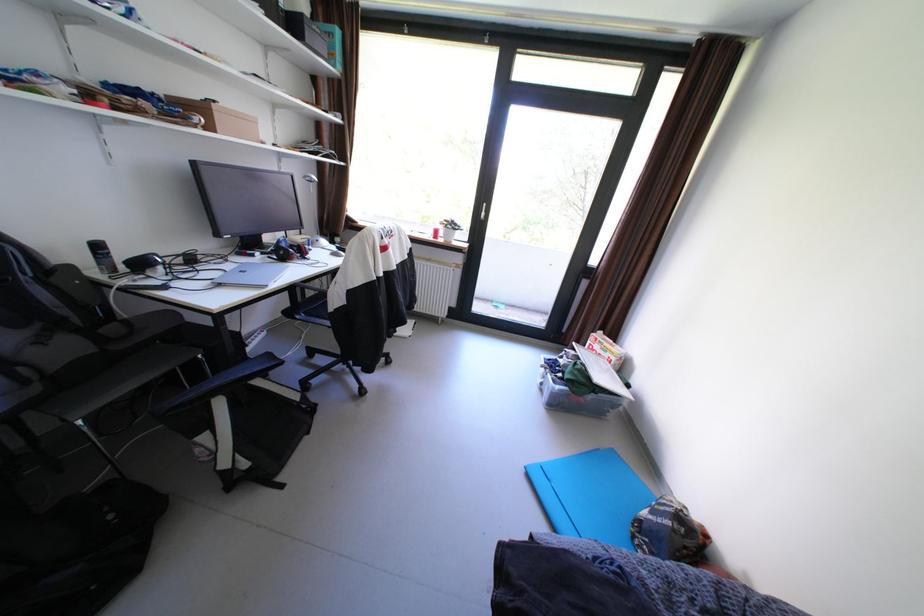
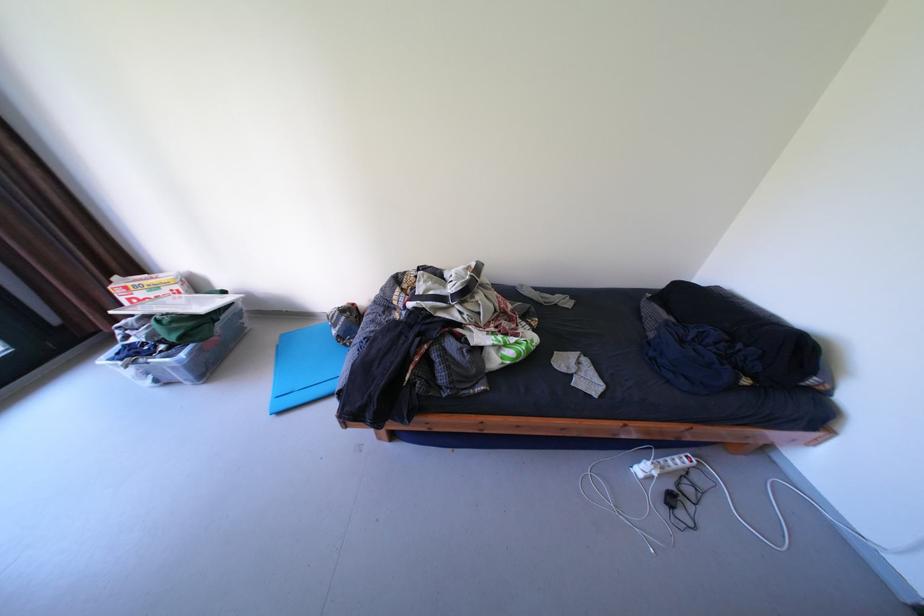
Locate, in the second image, the point that corresponds to point (624, 359) in the first image.

(188, 286)